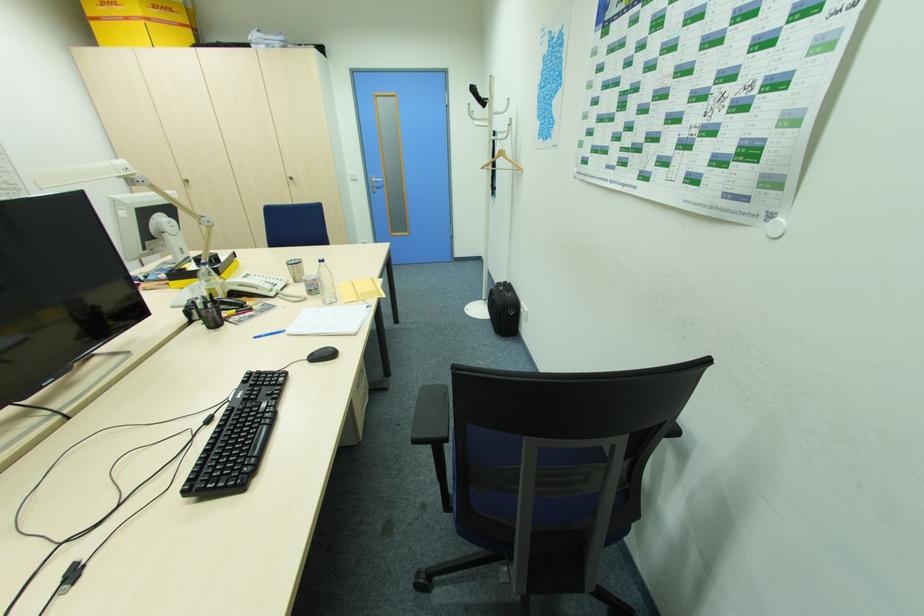
The width and height of the screenshot is (924, 616). Find the location of `black chair armrest`. black chair armrest is located at coordinates click(x=431, y=415).